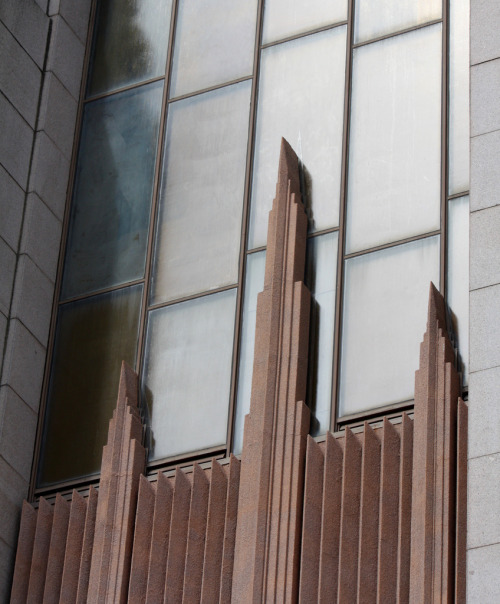
Find the location of a particular element. The height and width of the screenshot is (604, 500). wall is located at coordinates (492, 504).